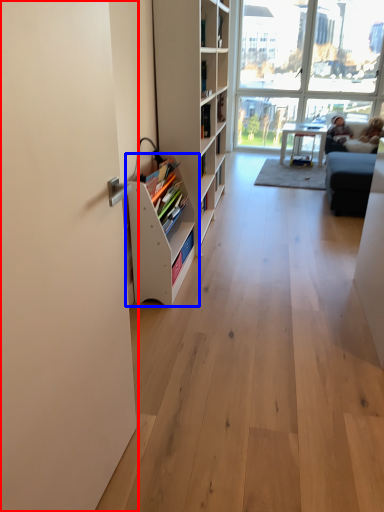
Question: Which object is further to the camera taking this photo, screen door (highlighted by a red box) or shelf (highlighted by a blue box)?

Choices:
 (A) screen door
 (B) shelf

Answer: (B)